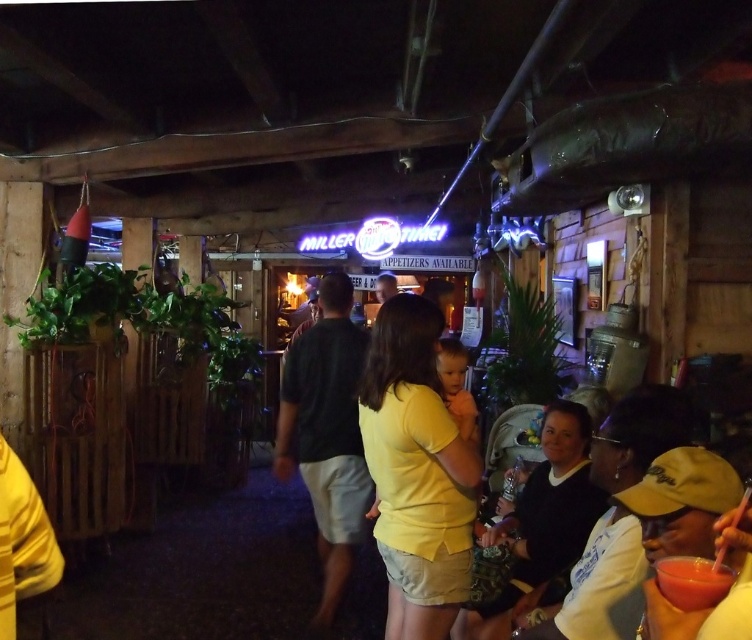
You are at the bar and want to order a drink. You see the yellow matte shirt at center and the smooth matte red drink at lower right. Which object is positioned to the right side?

The smooth matte red drink at lower right is positioned to the right of the yellow matte shirt at center.

You are a server in a bar and you need to deliver a smooth matte red drink at lower right to a customer standing at the yellow matte shirt at center. Can you reach the customer without moving? The minimum service distance required is 1.0 meters.

The distance between the yellow matte shirt at center and the smooth matte red drink at lower right is 1.10 meters, which meets the minimum service distance requirement of 1.0 meters. Therefore, you can reach the customer without moving.